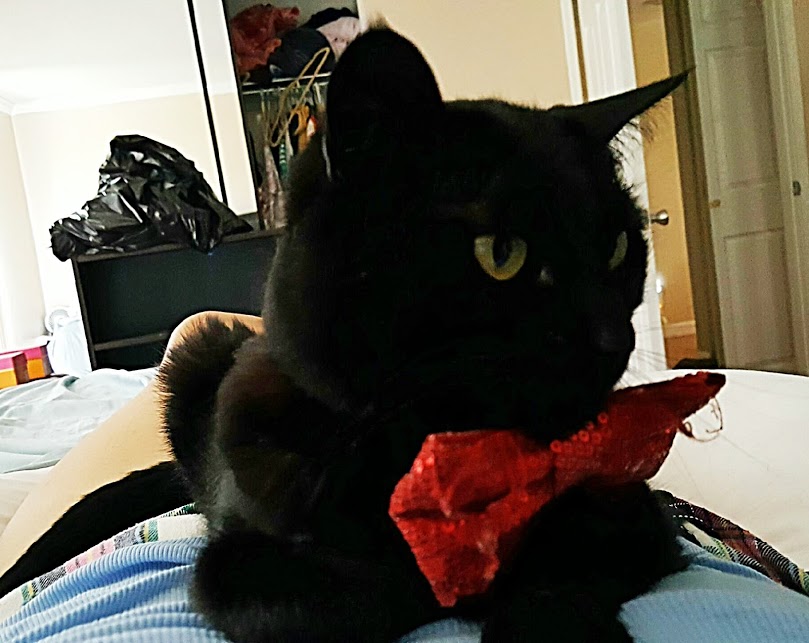
I want to click on white wall, so click(x=91, y=53).